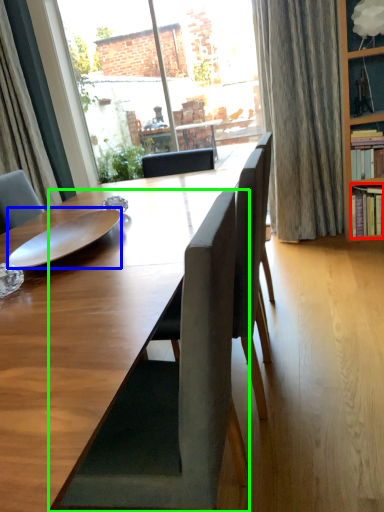
Question: Which object is the closest to the shelf (highlighted by a red box)? Choose among these: plate (highlighted by a blue box) or chair (highlighted by a green box).

Choices:
 (A) plate
 (B) chair

Answer: (A)